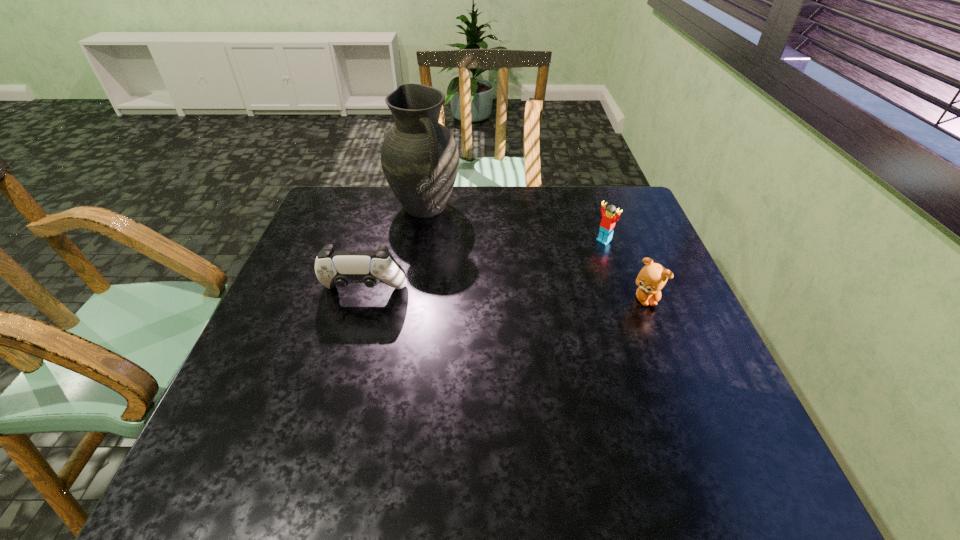
Identify the location of control. (341, 268).

You are a GUI agent. You are given a task and a screenshot of the screen. Output one action in this format:
    pyautogui.click(x=<x>, y=<y>)
    Task: Click on the teddy bear
    This screenshot has width=960, height=540.
    Given the screenshot: What is the action you would take?
    pyautogui.click(x=652, y=278)

The width and height of the screenshot is (960, 540). I want to click on the tallest object, so click(419, 156).

At what (x,y) coordinates should I click in order to perform the action: click on the farthest object. Please return your answer as a coordinate pair (x, y). Image resolution: width=960 pixels, height=540 pixels. Looking at the image, I should click on (419, 156).

The height and width of the screenshot is (540, 960). Find the location of `the third nearest object`. the third nearest object is located at coordinates (607, 225).

Identify the location of vacant space situated 0.260m on the front-facing side of the control. This screenshot has height=540, width=960. (335, 397).

You are a GUI agent. You are given a task and a screenshot of the screen. Output one action in this format:
    pyautogui.click(x=<x>, y=<y>)
    Task: Click on the free space located 0.190m on the face of the teddy bear
    This screenshot has width=960, height=540.
    Given the screenshot: What is the action you would take?
    pyautogui.click(x=674, y=373)

The width and height of the screenshot is (960, 540). What are the coordinates of `blank space located 0.240m on the side of the farthest object with the handle` in the screenshot? It's located at (471, 275).

This screenshot has height=540, width=960. What are the coordinates of `free location located on the side of the farthest object with the handle` in the screenshot? It's located at (451, 246).

This screenshot has height=540, width=960. Find the location of `vacant region located 0.360m on the side of the farthest object with the handle`. vacant region located 0.360m on the side of the farthest object with the handle is located at coordinates (492, 304).